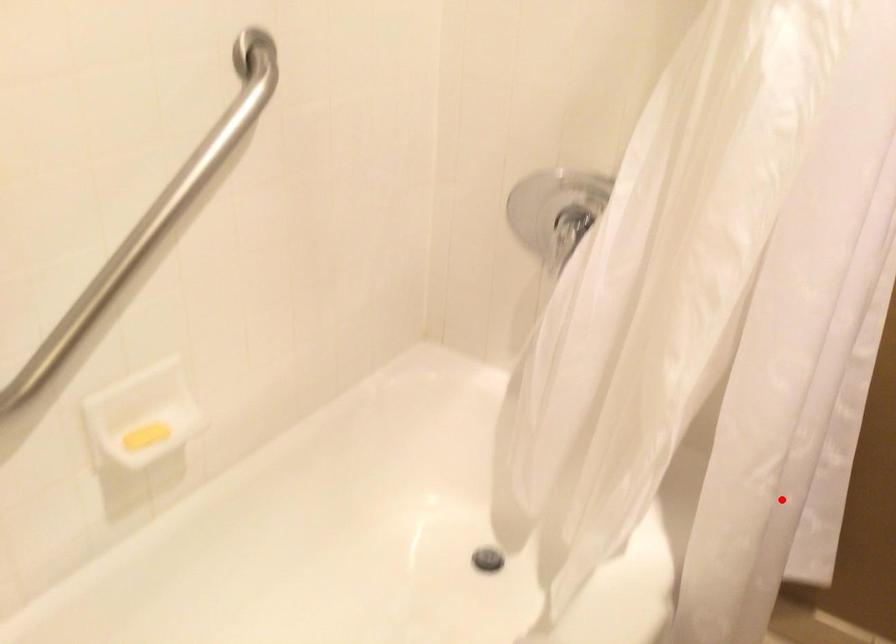
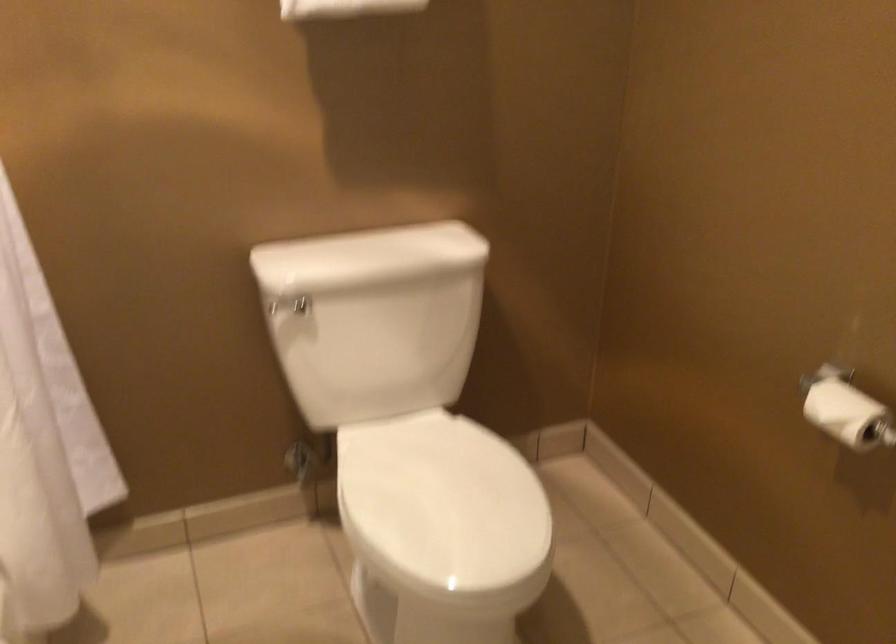
Question: I am providing you with two images of the same scene from different viewpoints. In image1, a red point is highlighted. Considering the same 3D point in image2, which of the following is correct?

Choices:
 (A) It is closer
 (B) It is farther

Answer: (B)